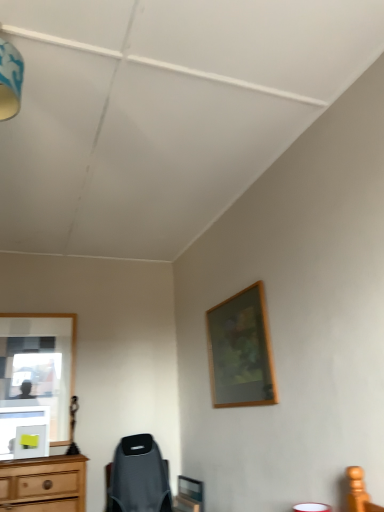
Question: From the image's perspective, is wooden picture frame at upper right over blue fabric lampshade at upper left?

Choices:
 (A) yes
 (B) no

Answer: (B)

Question: From a real-world perspective, is wooden picture frame at upper right beneath blue fabric lampshade at upper left?

Choices:
 (A) yes
 (B) no

Answer: (A)

Question: Is wooden picture frame at upper right bigger than blue fabric lampshade at upper left?

Choices:
 (A) no
 (B) yes

Answer: (B)

Question: Is wooden picture frame at upper right shorter than blue fabric lampshade at upper left?

Choices:
 (A) no
 (B) yes

Answer: (A)

Question: Is wooden picture frame at upper right at the right side of blue fabric lampshade at upper left?

Choices:
 (A) no
 (B) yes

Answer: (B)

Question: Can blue fabric lampshade at upper left be found inside wooden picture frame at upper right?

Choices:
 (A) no
 (B) yes

Answer: (A)

Question: Is blue fabric lampshade at upper left to the left of wooden picture frame at upper right from the viewer's perspective?

Choices:
 (A) no
 (B) yes

Answer: (B)

Question: From the image's perspective, is blue fabric lampshade at upper left over wooden picture frame at upper right?

Choices:
 (A) yes
 (B) no

Answer: (A)

Question: Would you consider blue fabric lampshade at upper left to be distant from wooden picture frame at upper right?

Choices:
 (A) yes
 (B) no

Answer: (A)

Question: From a real-world perspective, is blue fabric lampshade at upper left located beneath wooden picture frame at upper right?

Choices:
 (A) yes
 (B) no

Answer: (B)

Question: Is blue fabric lampshade at upper left to the right of wooden picture frame at upper right from the viewer's perspective?

Choices:
 (A) no
 (B) yes

Answer: (A)

Question: Is blue fabric lampshade at upper left shorter than wooden picture frame at upper right?

Choices:
 (A) yes
 (B) no

Answer: (A)

Question: Is point (16, 75) positioned closer to the camera than point (228, 330)?

Choices:
 (A) closer
 (B) farther

Answer: (A)